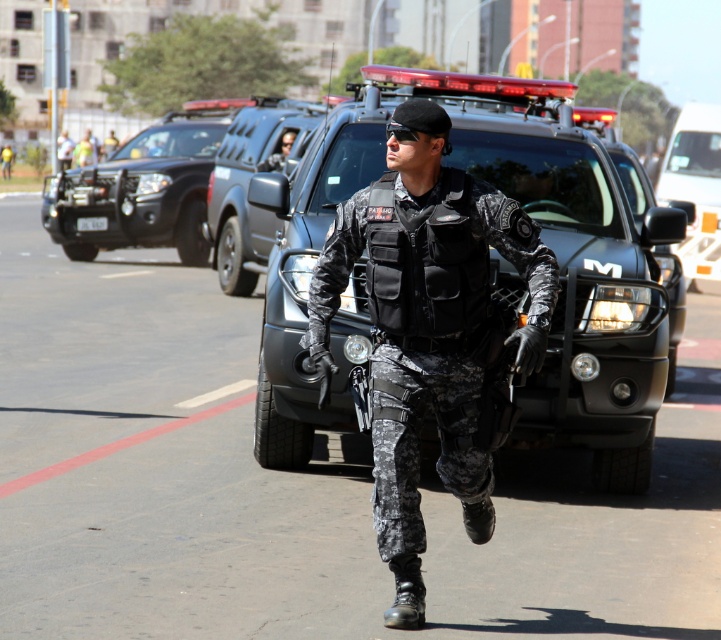
Question: Which point is closer to the camera?

Choices:
 (A) (340, 426)
 (B) (195, 189)
 (C) (663, 248)
 (D) (286, 134)

Answer: (A)

Question: Which point is closer to the camera taking this photo?

Choices:
 (A) (61, 228)
 (B) (267, 436)
 (C) (305, 129)

Answer: (B)

Question: Is black matte jeep at center thinner than glossy black truck at center?

Choices:
 (A) yes
 (B) no

Answer: (A)

Question: Does black matte jeep at center have a smaller size compared to matte black helmet at upper center?

Choices:
 (A) no
 (B) yes

Answer: (B)

Question: Which object appears farthest from the camera in this image?

Choices:
 (A) glossy black truck at center
 (B) black matte jeep at upper left
 (C) camouflage fabric uniform at center
 (D) black matte jeep at center

Answer: (B)

Question: From the image, what is the correct spatial relationship of black matte jeep at upper left in relation to glossy black truck at center?

Choices:
 (A) above
 (B) below

Answer: (A)